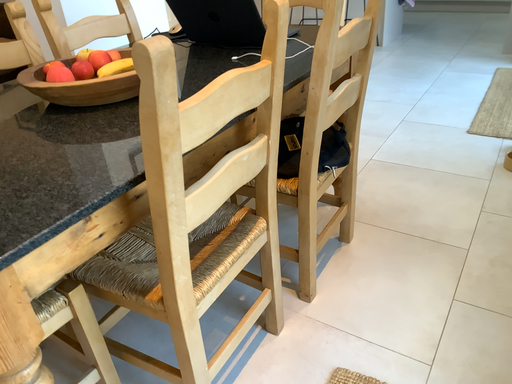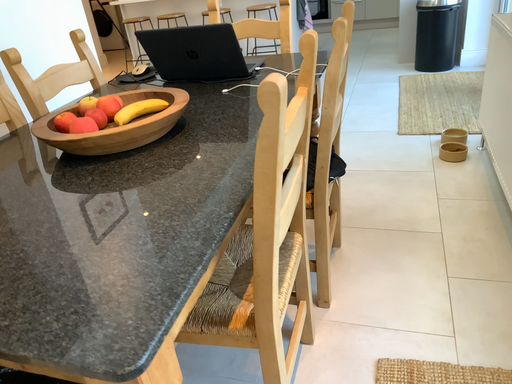
Question: How did the camera likely rotate when shooting the video?

Choices:
 (A) rotated left
 (B) rotated right

Answer: (B)